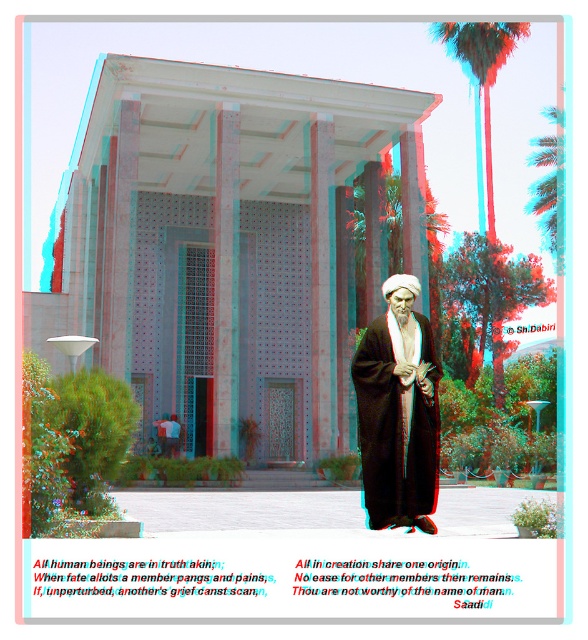
Question: Is brown matte robe at center bigger than green leafy palm tree at upper right?

Choices:
 (A) no
 (B) yes

Answer: (A)

Question: Does brown matte robe at center appear on the left side of green leafy palm tree at upper right?

Choices:
 (A) no
 (B) yes

Answer: (B)

Question: Which point is closer to the camera taking this photo?

Choices:
 (A) pos(522,29)
 (B) pos(415,454)

Answer: (B)

Question: Which of the following is the closest to the observer?

Choices:
 (A) (487, 58)
 (B) (409, 358)

Answer: (B)

Question: Is brown matte robe at center to the left of green leafy palm tree at upper right from the viewer's perspective?

Choices:
 (A) no
 (B) yes

Answer: (B)

Question: Which of the following is the closest to the observer?

Choices:
 (A) (517, 36)
 (B) (430, 445)

Answer: (B)